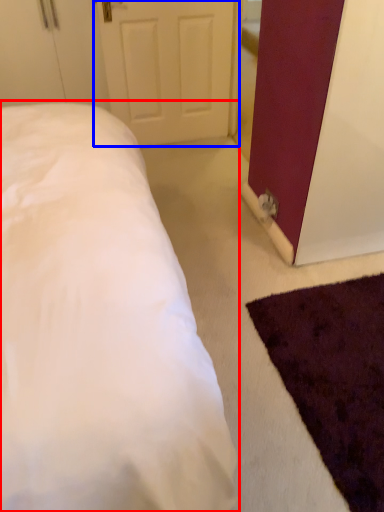
Question: Which object is further to the camera taking this photo, bed (highlighted by a red box) or door (highlighted by a blue box)?

Choices:
 (A) bed
 (B) door

Answer: (B)